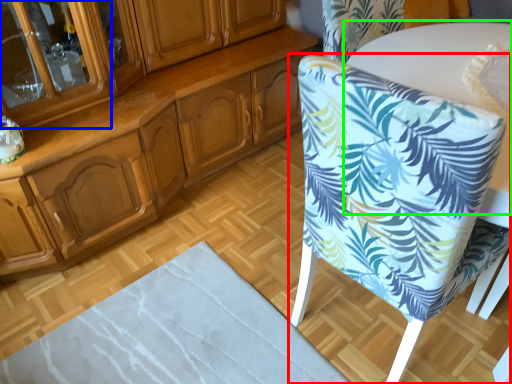
Question: Estimate the real-world distances between objects in this image. Which object is closer to chair (highlighted by a red box), glass door (highlighted by a blue box) or round table (highlighted by a green box)?

Choices:
 (A) glass door
 (B) round table

Answer: (B)